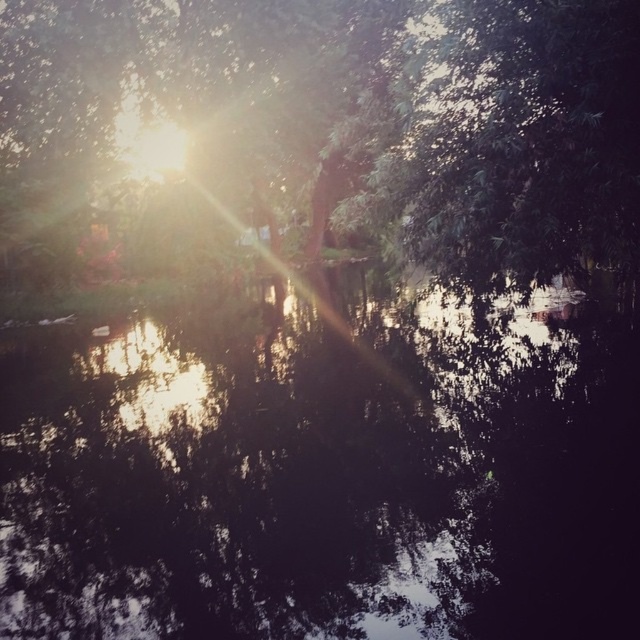
You are a photographer trying to capture the reflection of the green leafy tree at upper center in the black reflective water at center. Based on the scene description, will the reflection be clear or distorted?

The reflection of the green leafy tree at upper center in the black reflective water at center will be distorted because the water surface is described as having ripples and reflections that are slightly distorted due to the angle and movement of the water.

You are standing on the dock and want to throw a stone into the water. The stone you have can travel 8 meters. If you aim for the green leafy tree at upper center, will the stone land in the black reflective water at center?

The black reflective water at center is 7.88 meters from the green leafy tree at upper center. Since the stone can travel 8 meters, it will land in the black reflective water at center.